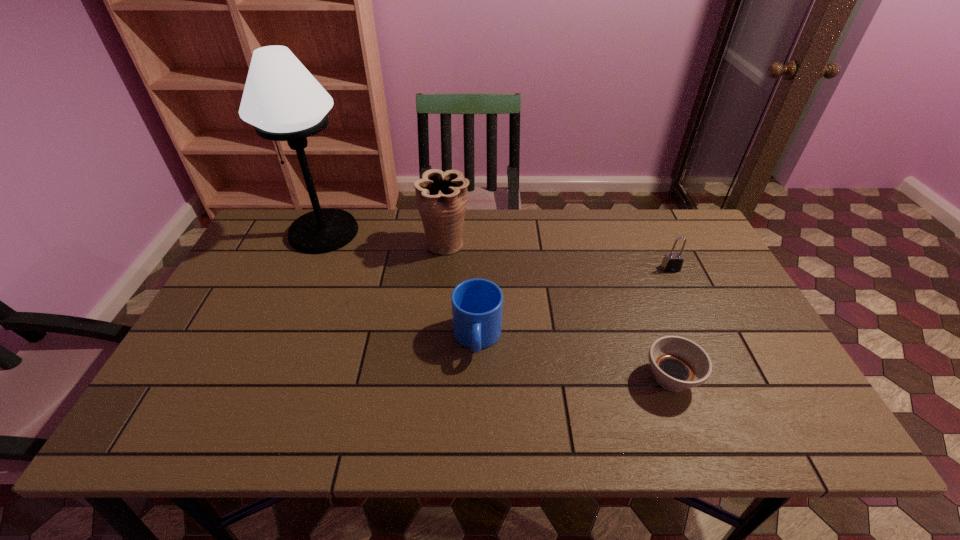
This screenshot has width=960, height=540. I want to click on free location located 0.120m on the side of the mug with the handle, so click(477, 411).

Where is `blank space located on the shackle of the third nearest object`? This screenshot has height=540, width=960. blank space located on the shackle of the third nearest object is located at coordinates (698, 327).

Where is `free spot located on the left of the soup bowl`? Image resolution: width=960 pixels, height=540 pixels. free spot located on the left of the soup bowl is located at coordinates (604, 379).

Identify the location of table lamp located in the far edge section of the desktop. The width and height of the screenshot is (960, 540). (281, 98).

Locate an element on the screen. This screenshot has width=960, height=540. urn that is at the far edge is located at coordinates click(441, 197).

What are the coordinates of `object present at the left edge` in the screenshot? It's located at (281, 98).

Where is `object that is positioned at the right edge`? object that is positioned at the right edge is located at coordinates (672, 262).

Where is `object at the far left corner`? This screenshot has height=540, width=960. object at the far left corner is located at coordinates click(x=281, y=98).

Locate an element on the screen. The height and width of the screenshot is (540, 960). vacant space at the far edge is located at coordinates (479, 254).

The width and height of the screenshot is (960, 540). I want to click on vacant space at the near edge of the desktop, so coord(564,409).